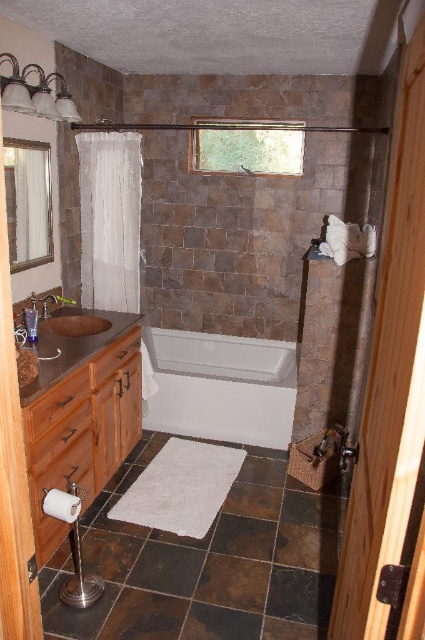
You are designing a bathroom layout and need to place a new decorative item between the dark brown tile at center and the matte brown sink at lower left. Which object should you place closer to the center of the room to ensure the item fits properly?

The dark brown tile at center is thinner than the matte brown sink at lower left, so you should place the decorative item closer to the center of the room near the dark brown tile at center to accommodate its smaller size.

You are standing in the bathroom and want to know which of the two points, point (240, 515) or point (79, 320), is closer to you. Based on the image, which point is nearer?

Point (240, 515) is closer to the camera than point (79, 320), so it is nearer to you.

You are designing a bathroom layout and need to ensure that the brown wood vanity at left and the brown textured tile at lower center are positioned appropriately. Based on their heights, which object should be placed higher to maintain visual balance?

The brown wood vanity at left is taller than the brown textured tile at lower center, so to maintain visual balance, the brown textured tile at lower center should be placed higher to match the height of the vanity.